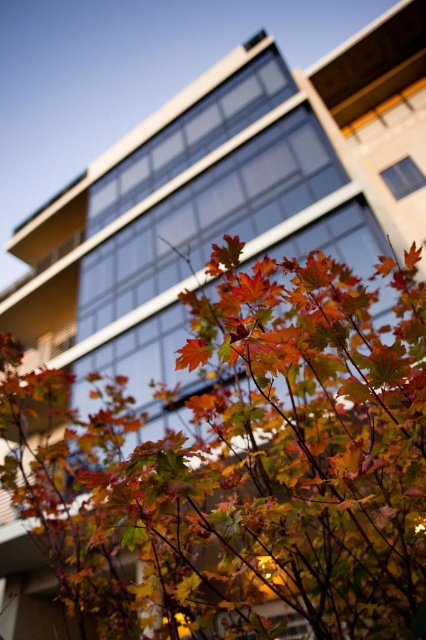
You are standing in front of the modern building and want to take a photo of the autumn leaves at center. Based on their position, where should you aim your camera?

The autumn leaves at center are located at coordinates point (245,465), so you should aim your camera towards the lower right area to capture them.

You are an artist planning to paint the autumn leaves at center and the orange matte maple leaf at center in the scene. Which one should you paint first if you want to depict them in the correct size relationship?

You should paint the autumn leaves at center first because they are larger than the orange matte maple leaf at center, allowing you to establish the size relationship properly.

You are standing in front of the modern building and notice two points marked on the facade. The first point is at coordinates point [279,397] and the second is at point [183,362]. Which point is closer to you?

Point [183,362] is closer to you because it is in front of point [279,397].